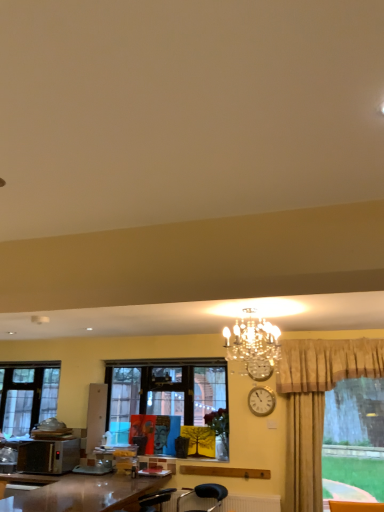
Question: Based on their positions, is silver metallic microwave oven at lower left located to the left or right of shiny brown desk at lower left?

Choices:
 (A) left
 (B) right

Answer: (A)

Question: Is silver metallic microwave oven at lower left taller or shorter than shiny brown desk at lower left?

Choices:
 (A) short
 (B) tall

Answer: (A)

Question: Which of these objects is positioned closest to the clear glass window at left, the first window from the back?

Choices:
 (A) metallic silver clock at upper center, which is counted as the second clock, starting from the bottom
 (B) matte wooden picture frame at center
 (C) silver metallic microwave oven at lower left
 (D) matte blue painting at center
 (E) shiny brown desk at lower left

Answer: (C)

Question: Which object is the farthest from the matte wooden picture frame at center?

Choices:
 (A) silver metallic clock at upper center, which is the second clock in top-to-bottom order
 (B) matte white cabinet at lower left
 (C) transparent glass window at center, which is counted as the 2th window, starting from the left
 (D) clear glass window at left, acting as the second window starting from the front
 (E) shiny brown desk at lower left

Answer: (D)